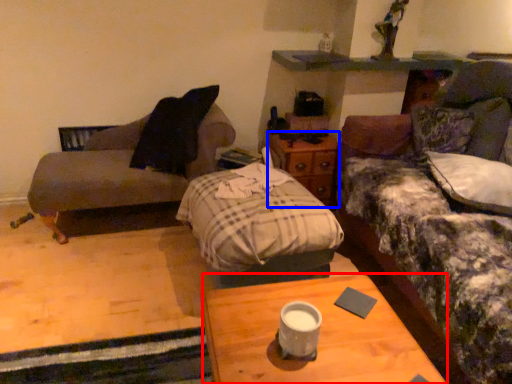
Question: Which of the following is the farthest to the observer, desk (highlighted by a red box) or nightstand (highlighted by a blue box)?

Choices:
 (A) desk
 (B) nightstand

Answer: (B)